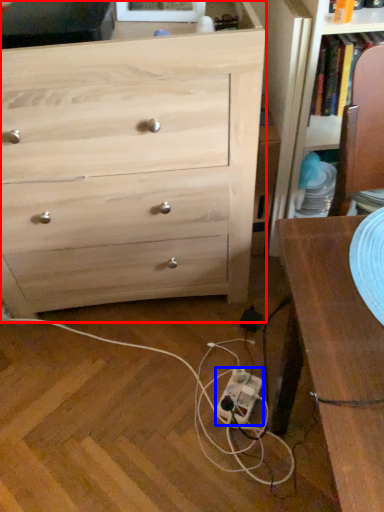
Question: Which of the following is the farthest to the observer, chest of drawers (highlighted by a red box) or extension cord (highlighted by a blue box)?

Choices:
 (A) chest of drawers
 (B) extension cord

Answer: (B)